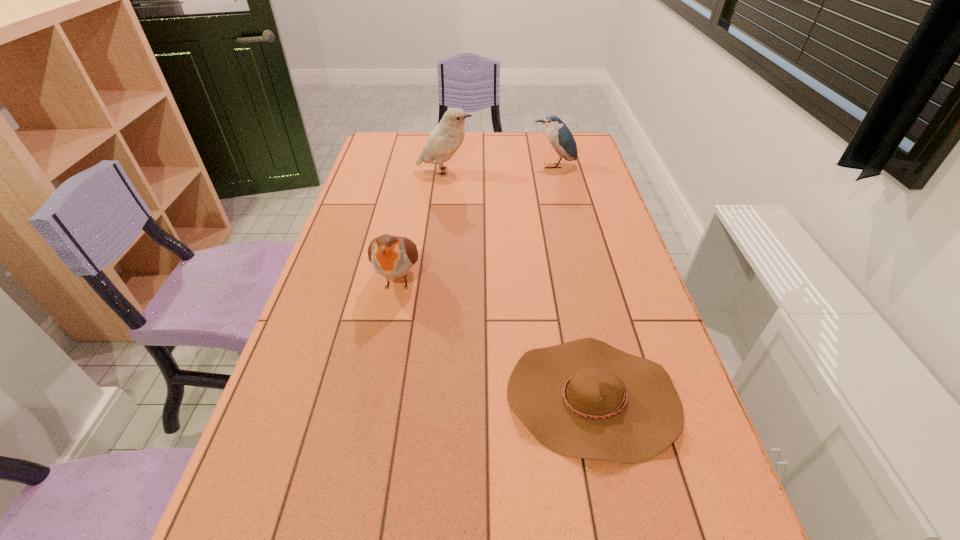
This screenshot has width=960, height=540. Find the location of `bird at the right edge`. bird at the right edge is located at coordinates (558, 134).

Identify the location of cowboy hat at the right edge. (585, 399).

Where is `vacant space at the far edge of the desktop`? This screenshot has width=960, height=540. vacant space at the far edge of the desktop is located at coordinates (470, 151).

In the image, there is a desktop. Identify the location of free space at the left edge. (376, 193).

This screenshot has height=540, width=960. In the image, there is a desktop. What are the coordinates of `free space at the right edge` in the screenshot? It's located at (614, 227).

Identify the location of free region at the far left corner. The height and width of the screenshot is (540, 960). (373, 141).

Identify the location of vacant region at the far right corner of the desktop. Image resolution: width=960 pixels, height=540 pixels. (563, 158).

This screenshot has height=540, width=960. I want to click on unoccupied position between the nearest object and the tallest object, so click(x=518, y=285).

In order to click on free point between the tallest object and the shortest object in this screenshot , I will do `click(518, 285)`.

At what (x,y) coordinates should I click in order to perform the action: click on free area in between the rightmost bird and the nearest bird. Please return your answer as a coordinate pair (x, y). This screenshot has width=960, height=540. Looking at the image, I should click on (476, 222).